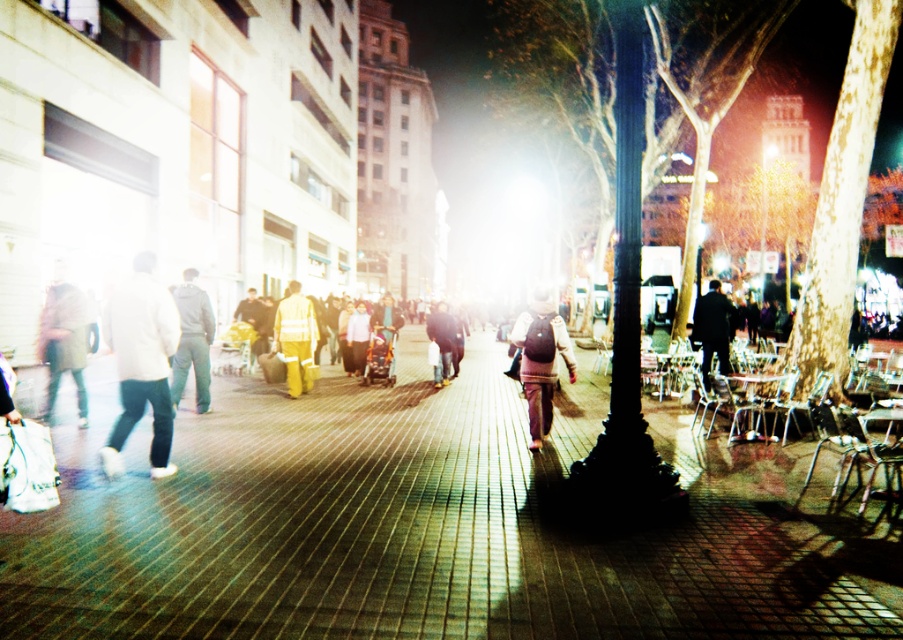
Is point (537, 337) positioned in front of point (259, 321)?

Yes.

Is matte brown backpack at center positioned in front of yellow fabric bag at center?

That is True.

What are the coordinates of `matte brown backpack at center` in the screenshot? It's located at (540, 360).

From the picture: Which is more to the right, brown brick pavement at center or white matte jacket at left?

brown brick pavement at center

Does brown brick pavement at center have a lesser height compared to white matte jacket at left?

Result: Indeed, brown brick pavement at center has a lesser height compared to white matte jacket at left.

Identify the location of brown brick pavement at center. (431, 524).

Between point (629, 364) and point (435, 387), which one is positioned in front?

Point (629, 364)

Is black polished pole at center bigger than dark gray jacket at center?

Incorrect, black polished pole at center is not larger than dark gray jacket at center.

Is point (619, 180) in front of point (452, 339)?

Yes.

Identify the location of black polished pole at center. (626, 317).